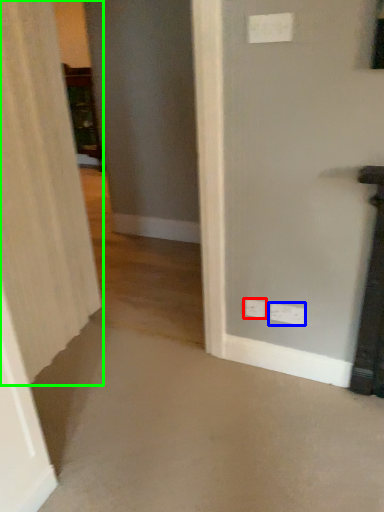
Question: Which object is the closest to the electric outlet (highlighted by a red box)? Choose among these: electric outlet (highlighted by a blue box) or curtain (highlighted by a green box).

Choices:
 (A) electric outlet
 (B) curtain

Answer: (A)